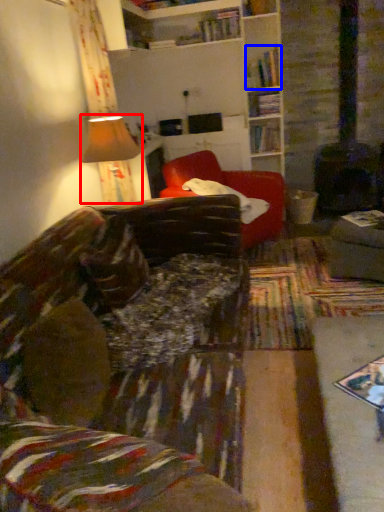
Question: Which point is closer to the camera, lamp (highlighted by a red box) or book (highlighted by a blue box)?

Choices:
 (A) lamp
 (B) book

Answer: (A)